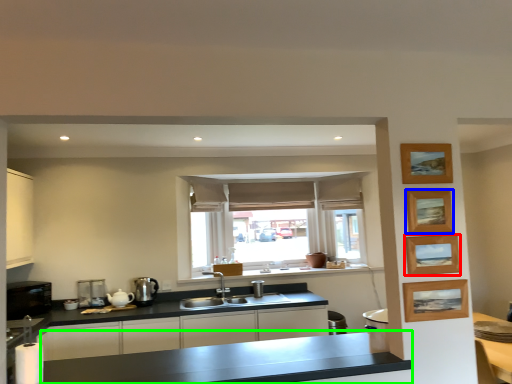
Question: Based on their relative distances, which object is nearer to picture frame (highlighted by a red box)? Choose from picture frame (highlighted by a blue box) and countertop (highlighted by a green box).

Choices:
 (A) picture frame
 (B) countertop

Answer: (A)